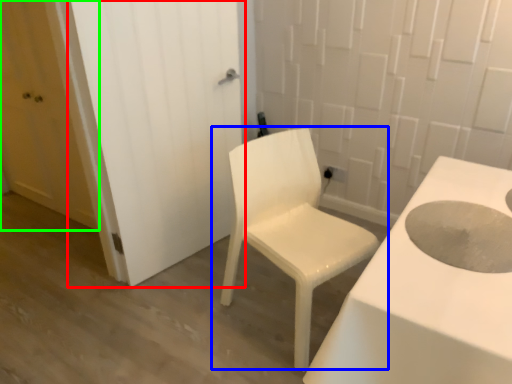
Question: Which is farther away from door (highlighted by a red box)? chair (highlighted by a blue box) or door (highlighted by a green box)?

Choices:
 (A) chair
 (B) door

Answer: (B)